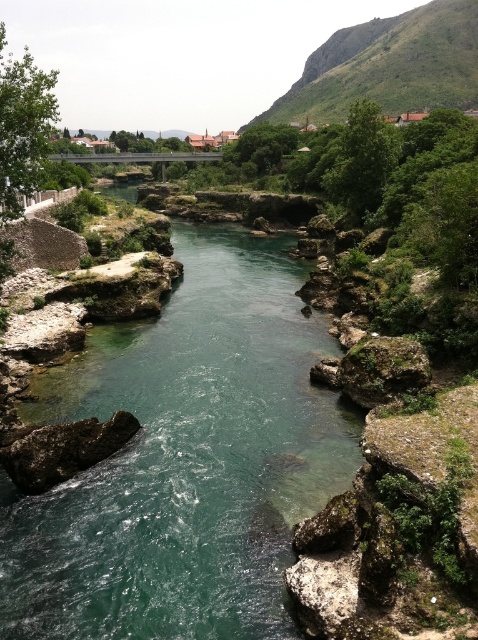
Question: Which point is farther from the camera taking this photo?

Choices:
 (A) (456, 49)
 (B) (239, 252)
 (C) (111, 449)

Answer: (A)

Question: Which point appears farthest from the camera in this image?

Choices:
 (A) (10, 451)
 (B) (71, 620)

Answer: (A)

Question: Which object is farther from the camera taking this photo?

Choices:
 (A) clear water at center
 (B) rough brown rock at lower left

Answer: (B)

Question: Is clear water at center above rough brown rock at lower left?

Choices:
 (A) no
 (B) yes

Answer: (B)

Question: Is green grassy hillside at upper right closer to camera compared to rough brown rock at lower left?

Choices:
 (A) yes
 (B) no

Answer: (B)

Question: In this image, where is clear water at center located relative to green grassy hillside at upper right?

Choices:
 (A) below
 (B) above

Answer: (A)